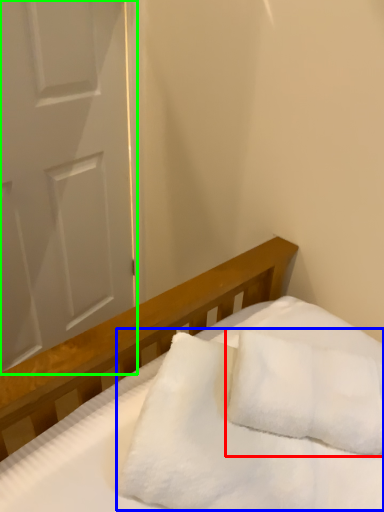
Question: Considering the real-world distances, which object is closest to pillow (highlighted by a red box)? blanket (highlighted by a blue box) or door (highlighted by a green box).

Choices:
 (A) blanket
 (B) door

Answer: (A)